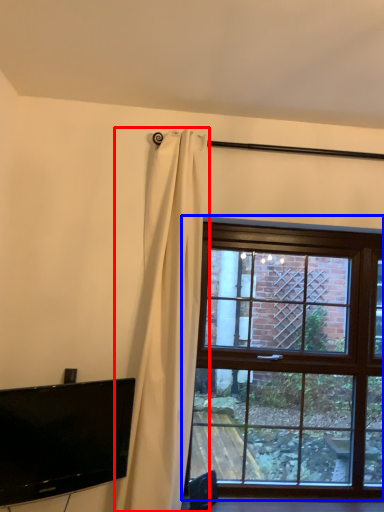
Question: Which point is further to the camera, curtain (highlighted by a red box) or window (highlighted by a blue box)?

Choices:
 (A) curtain
 (B) window

Answer: (B)